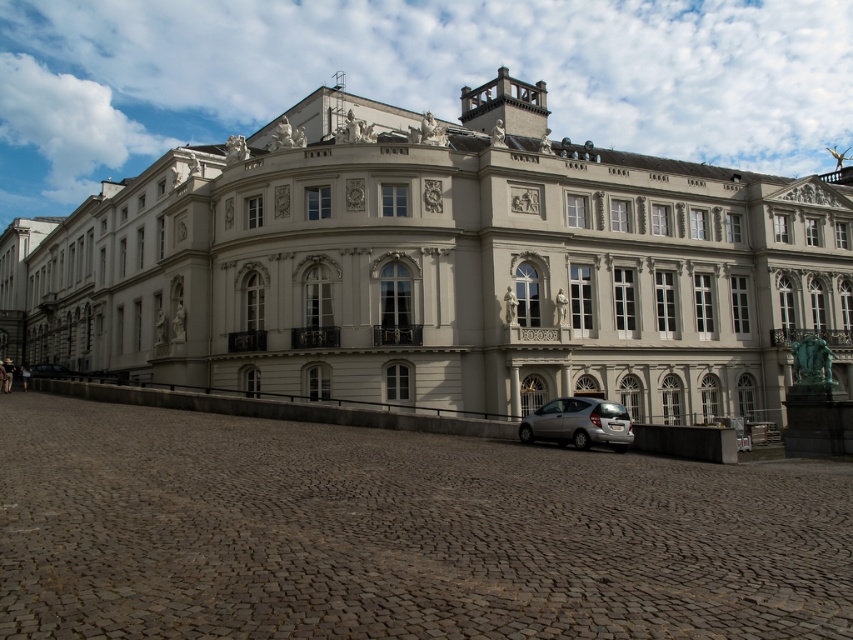
Between point (480, 164) and point (538, 422), which one is positioned in front?

Point (538, 422) is more forward.

Who is higher up, white stone building at center or silver metallic hatchback at lower center?

white stone building at center is above.

Is point (648, 241) positioned before point (550, 403)?

That is False.

Find the location of a particular element. white stone building at center is located at coordinates (439, 268).